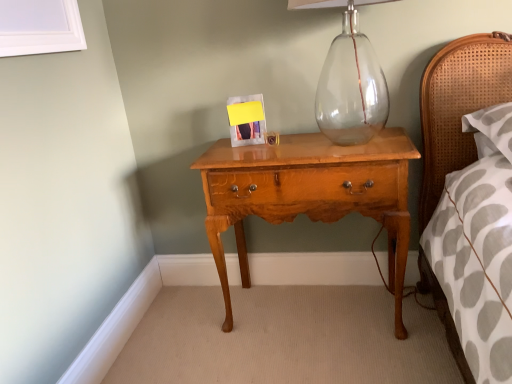
Question: Should I look upward or downward to see light brown wood nightstand at center?

Choices:
 (A) up
 (B) down

Answer: (B)

Question: From the image's perspective, does light brown wood nightstand at center appear lower than yellow paper at center?

Choices:
 (A) no
 (B) yes

Answer: (B)

Question: From a real-world perspective, is light brown wood nightstand at center over yellow paper at center?

Choices:
 (A) no
 (B) yes

Answer: (A)

Question: Is light brown wood nightstand at center closer to camera compared to yellow paper at center?

Choices:
 (A) yes
 (B) no

Answer: (A)

Question: Could you tell me if light brown wood nightstand at center is turned towards yellow paper at center?

Choices:
 (A) yes
 (B) no

Answer: (B)

Question: Considering the relative sizes of light brown wood nightstand at center and yellow paper at center in the image provided, is light brown wood nightstand at center thinner than yellow paper at center?

Choices:
 (A) no
 (B) yes

Answer: (A)

Question: From the image's perspective, does light brown wood nightstand at center appear higher than yellow paper at center?

Choices:
 (A) yes
 (B) no

Answer: (B)

Question: Considering the relative sizes of yellow paper at center and light brown wood nightstand at center in the image provided, is yellow paper at center shorter than light brown wood nightstand at center?

Choices:
 (A) no
 (B) yes

Answer: (B)

Question: Is yellow paper at center aimed at light brown wood nightstand at center?

Choices:
 (A) yes
 (B) no

Answer: (B)

Question: From the image's perspective, is yellow paper at center located beneath light brown wood nightstand at center?

Choices:
 (A) no
 (B) yes

Answer: (A)

Question: Can light brown wood nightstand at center be found inside yellow paper at center?

Choices:
 (A) yes
 (B) no

Answer: (B)

Question: Considering the relative sizes of yellow paper at center and light brown wood nightstand at center in the image provided, is yellow paper at center wider than light brown wood nightstand at center?

Choices:
 (A) yes
 (B) no

Answer: (B)

Question: From a real-world perspective, is yellow paper at center on light brown wood nightstand at center?

Choices:
 (A) yes
 (B) no

Answer: (A)

Question: Considering the relative positions of light brown wood nightstand at center and yellow paper at center in the image provided, is light brown wood nightstand at center to the left or to the right of yellow paper at center?

Choices:
 (A) left
 (B) right

Answer: (B)